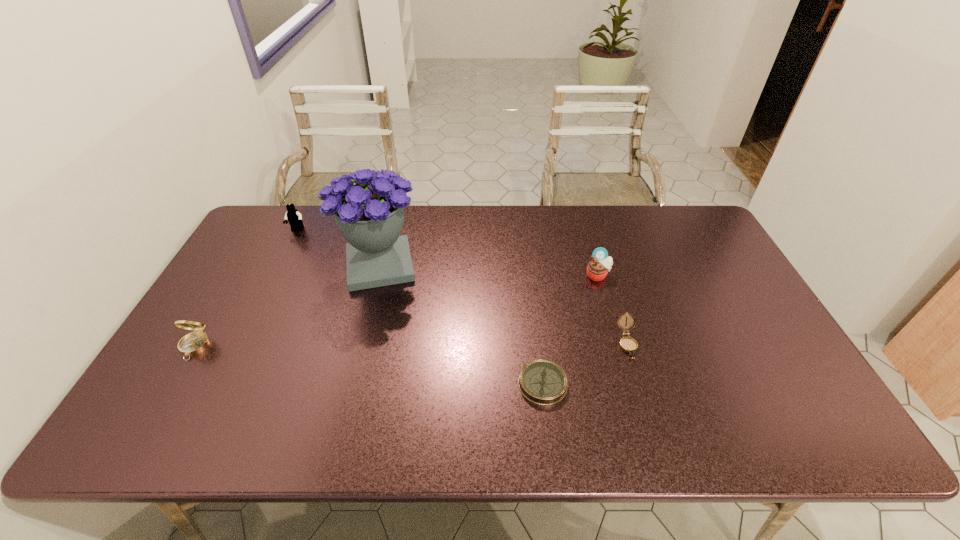
Identify the location of compass present at the left edge. Image resolution: width=960 pixels, height=540 pixels. (194, 343).

At what (x,y) coordinates should I click in order to perform the action: click on object that is at the far left corner. Please return your answer as a coordinate pair (x, y). Image resolution: width=960 pixels, height=540 pixels. Looking at the image, I should click on (294, 218).

Image resolution: width=960 pixels, height=540 pixels. I want to click on free space at the far edge of the desktop, so click(x=469, y=210).

In order to click on free space at the left edge in this screenshot , I will do `click(271, 275)`.

What are the coordinates of `free point at the right edge` in the screenshot? It's located at (775, 352).

At what (x,y) coordinates should I click in order to perform the action: click on vacant area at the far left corner of the desktop. Please return your answer as a coordinate pair (x, y). This screenshot has width=960, height=540. Looking at the image, I should click on (263, 228).

In the image, there is a desktop. At what (x,y) coordinates should I click in order to perform the action: click on blank space at the far right corner. Please return your answer as a coordinate pair (x, y). The height and width of the screenshot is (540, 960). Looking at the image, I should click on (684, 218).

Locate an element on the screen. This screenshot has height=540, width=960. free space that is in between the fifth object from right to left and the muffin is located at coordinates (447, 253).

The image size is (960, 540). I want to click on vacant space that is in between the third object from left to right and the muffin, so click(489, 271).

The image size is (960, 540). What are the coordinates of `empty space between the fourth object from right to left and the rightmost compass` in the screenshot? It's located at (503, 305).